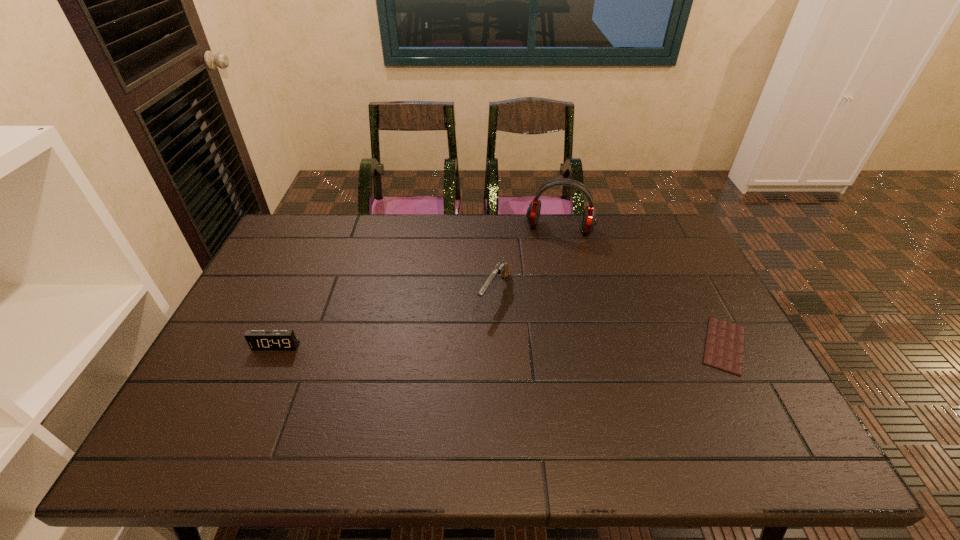
Find the location of `free spot on the desktop that is between the third tallest object and the shortest object and is positioned aiming along the barrel of the second tallest object`. free spot on the desktop that is between the third tallest object and the shortest object and is positioned aiming along the barrel of the second tallest object is located at coordinates (462, 346).

Where is `vacant space on the desktop that is between the second shortest object and the rightmost object and is positioned on the ear cups of the tallest object`? vacant space on the desktop that is between the second shortest object and the rightmost object and is positioned on the ear cups of the tallest object is located at coordinates (540, 346).